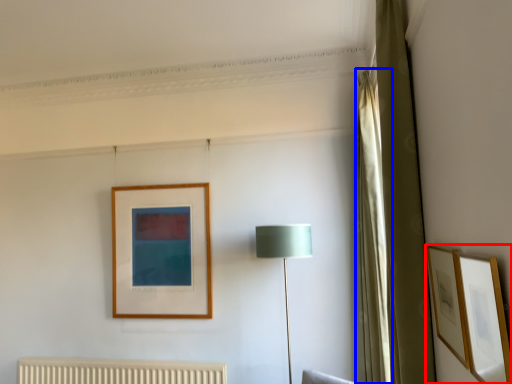
Question: Which object appears farthest to the camera in this image, picture frame (highlighted by a red box) or curtain (highlighted by a blue box)?

Choices:
 (A) picture frame
 (B) curtain

Answer: (B)